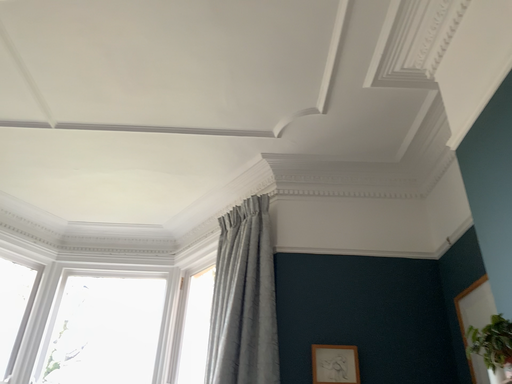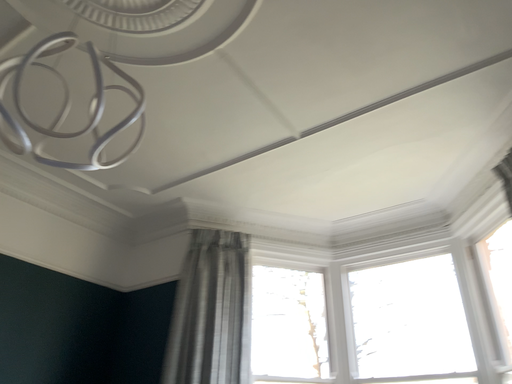
Question: Which way did the camera rotate in the video?

Choices:
 (A) rotated upward
 (B) rotated downward

Answer: (B)